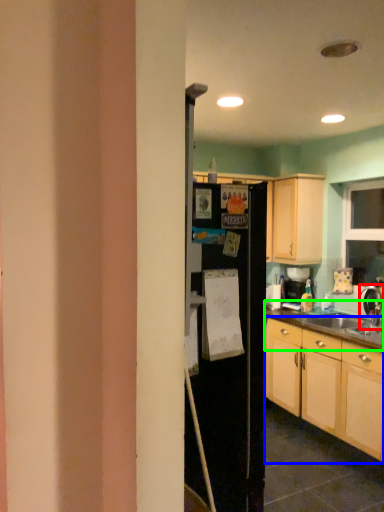
Question: Considering the real-world distances, which object is closest to tap (highlighted by a red box)? cabinetry (highlighted by a blue box) or countertop (highlighted by a green box).

Choices:
 (A) cabinetry
 (B) countertop

Answer: (B)